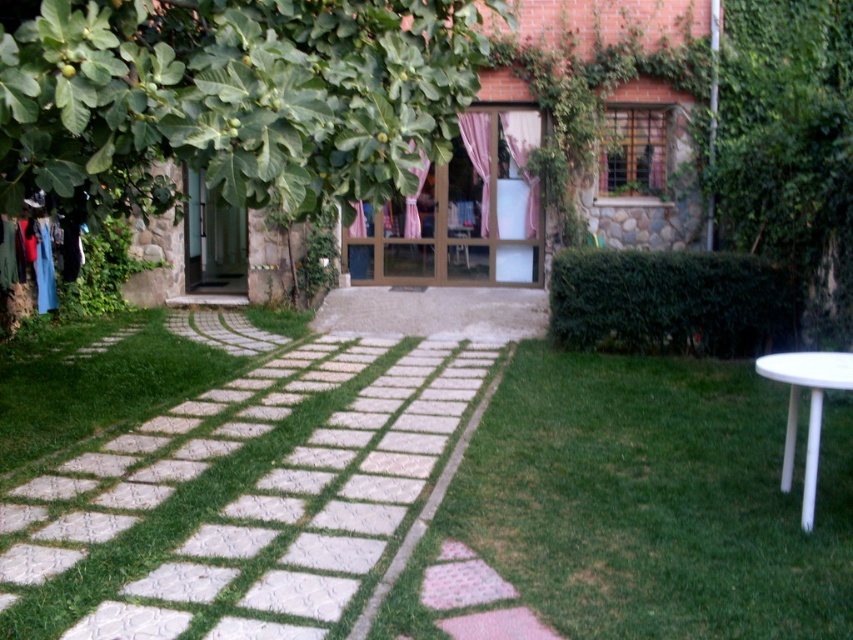
Question: Among these objects, which one is farthest from the camera?

Choices:
 (A) white sheer curtain at center
 (B) pink fabric curtain at center

Answer: (A)

Question: In this image, where is matte glass door at center located relative to white plastic table at right?

Choices:
 (A) above
 (B) below

Answer: (A)

Question: Among these objects, which one is farthest from the camera?

Choices:
 (A) matte glass door at center
 (B) white sheer curtain at center

Answer: (B)

Question: Does white plastic table at right lie behind pink fabric curtain at center?

Choices:
 (A) yes
 (B) no

Answer: (A)

Question: Which of the following is the farthest from the observer?

Choices:
 (A) white plastic table at right
 (B) matte glass door at center
 (C) white sheer curtain at center
 (D) pink fabric curtain at center

Answer: (C)

Question: Is matte glass door at center above pink fabric curtain at center?

Choices:
 (A) yes
 (B) no

Answer: (A)